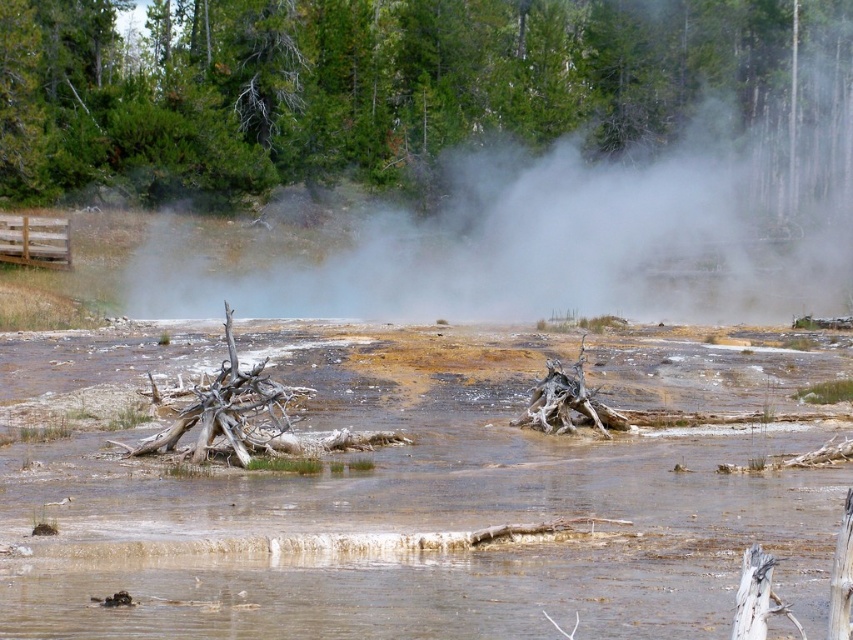
Question: Which point is farther from the camera taking this photo?

Choices:
 (A) (173, 294)
 (B) (775, 12)

Answer: (B)

Question: Can you confirm if brown muddy water at center is thinner than green textured tree at upper center?

Choices:
 (A) no
 (B) yes

Answer: (B)

Question: Does brown muddy water at center come in front of white vapor at upper center?

Choices:
 (A) yes
 (B) no

Answer: (A)

Question: Which point is farther from the camera taking this photo?

Choices:
 (A) (320, 280)
 (B) (285, 176)
 (C) (194, 484)

Answer: (B)

Question: Which of these objects is positioned closest to the brown muddy water at center?

Choices:
 (A) white vapor at upper center
 (B) green textured tree at upper center

Answer: (A)

Question: Can you confirm if brown muddy water at center is thinner than white vapor at upper center?

Choices:
 (A) yes
 (B) no

Answer: (A)